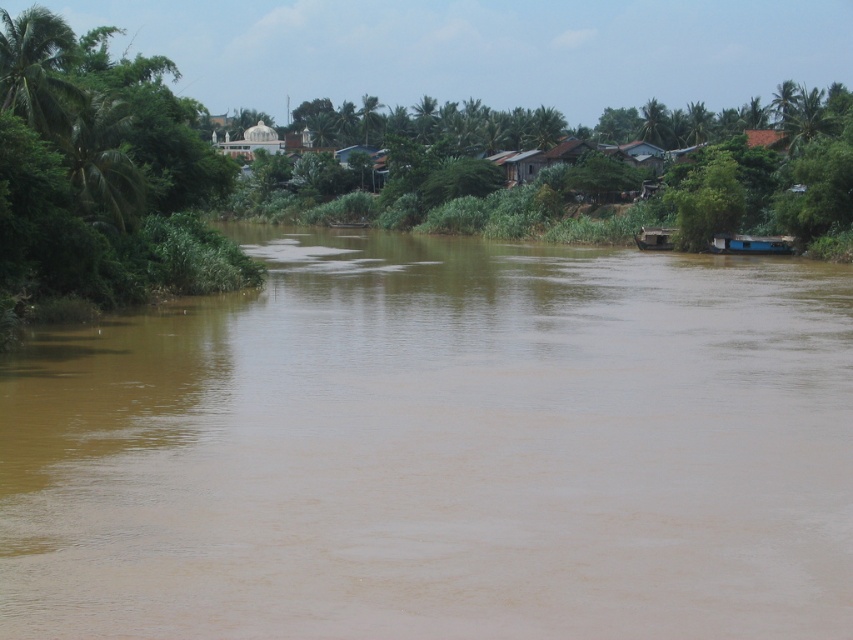
Can you confirm if green leafy tree at left is taller than brown wooden boat at right?

Yes.

Does green leafy tree at left appear on the left side of brown wooden boat at right?

Indeed, green leafy tree at left is positioned on the left side of brown wooden boat at right.

The image size is (853, 640). What do you see at coordinates (103, 172) in the screenshot? I see `green leafy tree at left` at bounding box center [103, 172].

This screenshot has width=853, height=640. What are the coordinates of `green leafy tree at left` in the screenshot? It's located at (103, 172).

How far apart are green leafy tree at left and blue matte houseboat at right?

Result: green leafy tree at left is 125.38 feet away from blue matte houseboat at right.

Can you confirm if green leafy tree at left is positioned below blue matte houseboat at right?

Actually, green leafy tree at left is above blue matte houseboat at right.

Is point (113, 138) positioned after point (737, 236)?

That is False.

Locate an element on the screen. This screenshot has width=853, height=640. green leafy tree at left is located at coordinates (103, 172).

Based on the photo, does brown muddy water at center have a lesser height compared to green leafy tree at left?

Yes, brown muddy water at center is shorter than green leafy tree at left.

Can you confirm if brown muddy water at center is thinner than green leafy tree at left?

In fact, brown muddy water at center might be wider than green leafy tree at left.

Between point (427, 541) and point (65, 166), which one is positioned behind?

Point (65, 166)

You are a GUI agent. You are given a task and a screenshot of the screen. Output one action in this format:
    pyautogui.click(x=<x>, y=<y>)
    Task: Click on the brown muddy water at center
    The height and width of the screenshot is (640, 853).
    Given the screenshot: What is the action you would take?
    pyautogui.click(x=440, y=449)